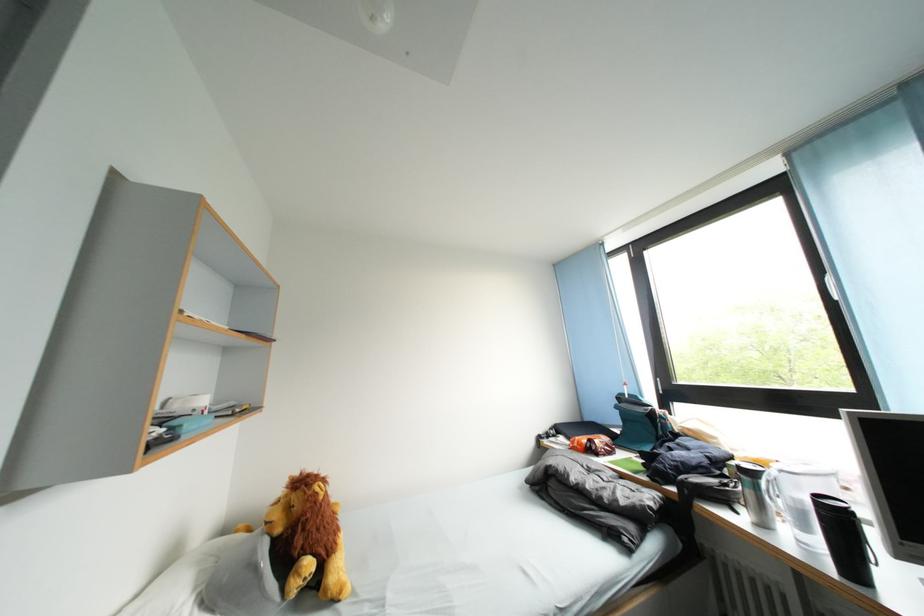
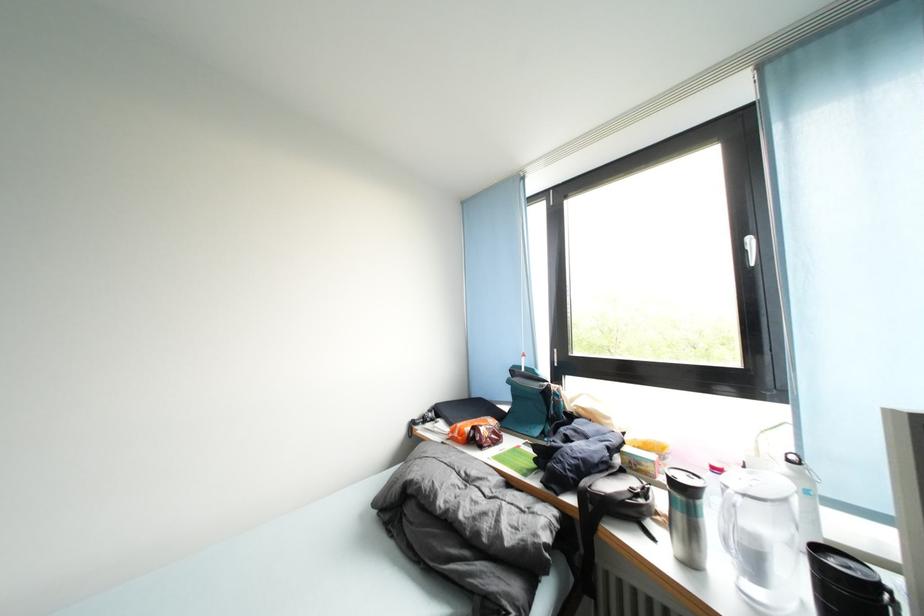
Locate, in the second image, the point that corresponds to (681,493) in the first image.

(579, 505)